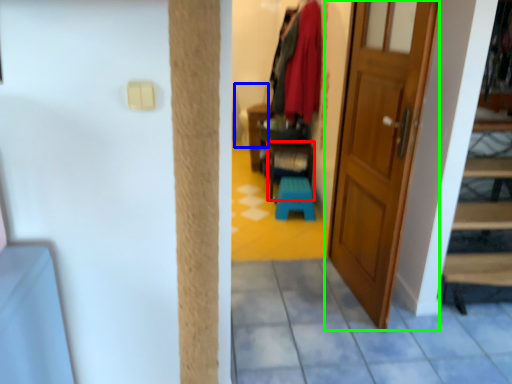
Question: Which object is positioned closest to furniture (highlighted by a red box)? Select from armchair (highlighted by a blue box) and door (highlighted by a green box).

Choices:
 (A) armchair
 (B) door

Answer: (A)